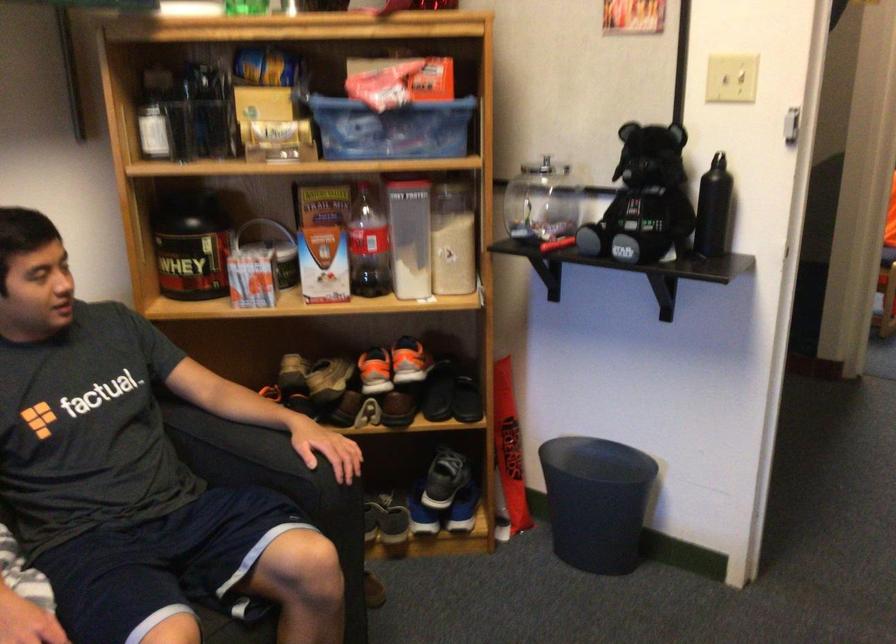
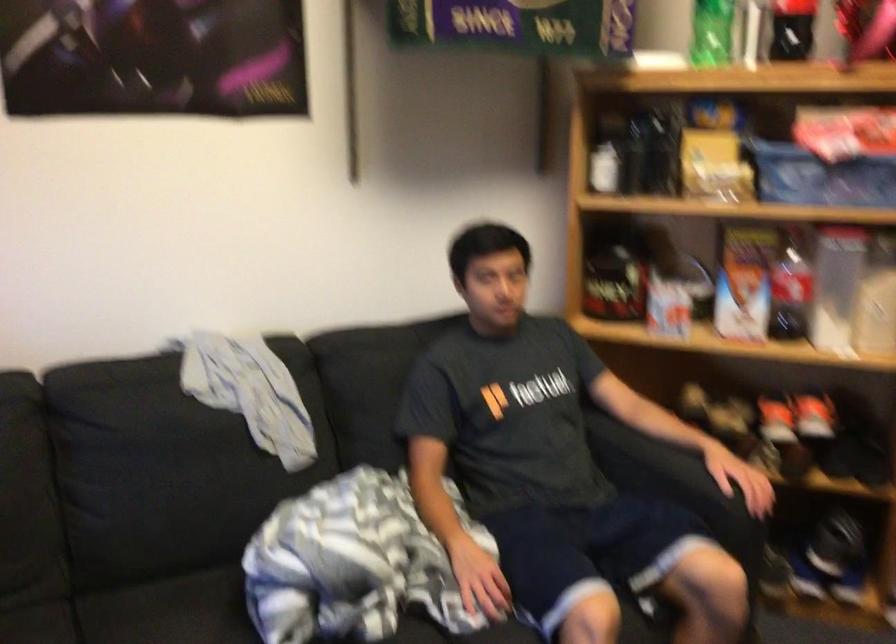
Find the pixel in the second image that matches (237,453) in the first image.

(650, 464)